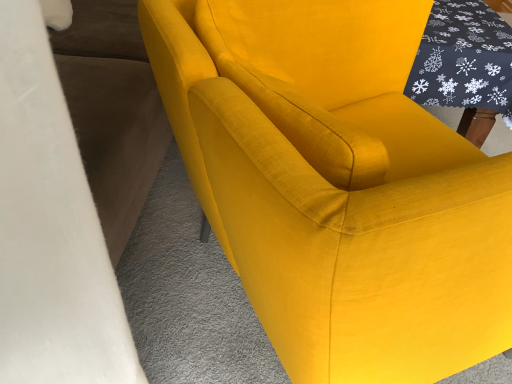
Question: Considering the positions of dark gray fabric table at upper right and matte yellow fabric chair at center in the image, is dark gray fabric table at upper right wider or thinner than matte yellow fabric chair at center?

Choices:
 (A) wide
 (B) thin

Answer: (B)

Question: From a real-world perspective, is dark gray fabric table at upper right physically located above or below matte yellow fabric chair at center?

Choices:
 (A) below
 (B) above

Answer: (A)

Question: Would you say dark gray fabric table at upper right is to the left or to the right of matte yellow fabric chair at center in the picture?

Choices:
 (A) right
 (B) left

Answer: (A)

Question: From a real-world perspective, is matte yellow fabric chair at center positioned above or below dark gray fabric table at upper right?

Choices:
 (A) below
 (B) above

Answer: (B)

Question: Looking at their shapes, would you say matte yellow fabric chair at center is wider or thinner than dark gray fabric table at upper right?

Choices:
 (A) wide
 (B) thin

Answer: (A)

Question: Relative to dark gray fabric table at upper right, is matte yellow fabric chair at center in front or behind?

Choices:
 (A) front
 (B) behind

Answer: (A)

Question: In terms of size, does matte yellow fabric chair at center appear bigger or smaller than dark gray fabric table at upper right?

Choices:
 (A) big
 (B) small

Answer: (A)